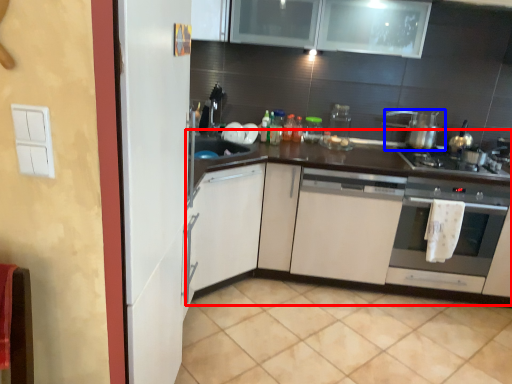
Question: Which of the following is the closest to the observer, countertop (highlighted by a red box) or kitchen appliance (highlighted by a blue box)?

Choices:
 (A) countertop
 (B) kitchen appliance

Answer: (A)